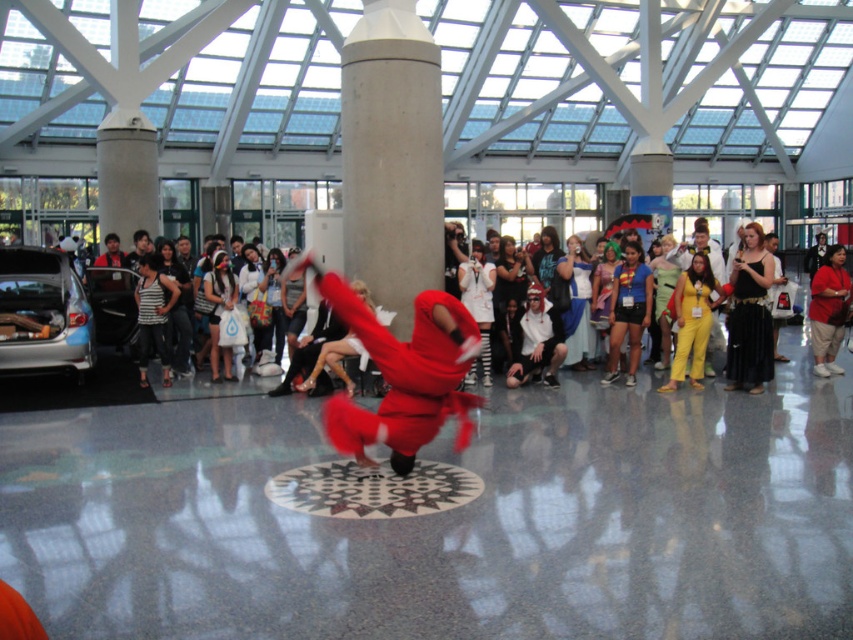
Does matte red costume at center appear on the right side of yellow fabric pants at center?

In fact, matte red costume at center is to the left of yellow fabric pants at center.

Consider the image. Can you confirm if matte red costume at center is positioned to the left of yellow fabric pants at center?

Indeed, matte red costume at center is positioned on the left side of yellow fabric pants at center.

The height and width of the screenshot is (640, 853). Find the location of `matte red costume at center`. matte red costume at center is located at coordinates (402, 372).

Does silver metallic car at left have a smaller size compared to yellow fabric pants at center?

No.

What do you see at coordinates (42, 314) in the screenshot?
I see `silver metallic car at left` at bounding box center [42, 314].

Between point (33, 269) and point (693, 339), which one is positioned in front?

Positioned in front is point (693, 339).

Locate an element on the screen. This screenshot has height=640, width=853. silver metallic car at left is located at coordinates (42, 314).

Does silver metallic car at left lie behind black satin dress at right?

Yes, it is behind black satin dress at right.

At what (x,y) coordinates should I click in order to perform the action: click on silver metallic car at left. Please return your answer as a coordinate pair (x, y). This screenshot has height=640, width=853. Looking at the image, I should click on (42, 314).